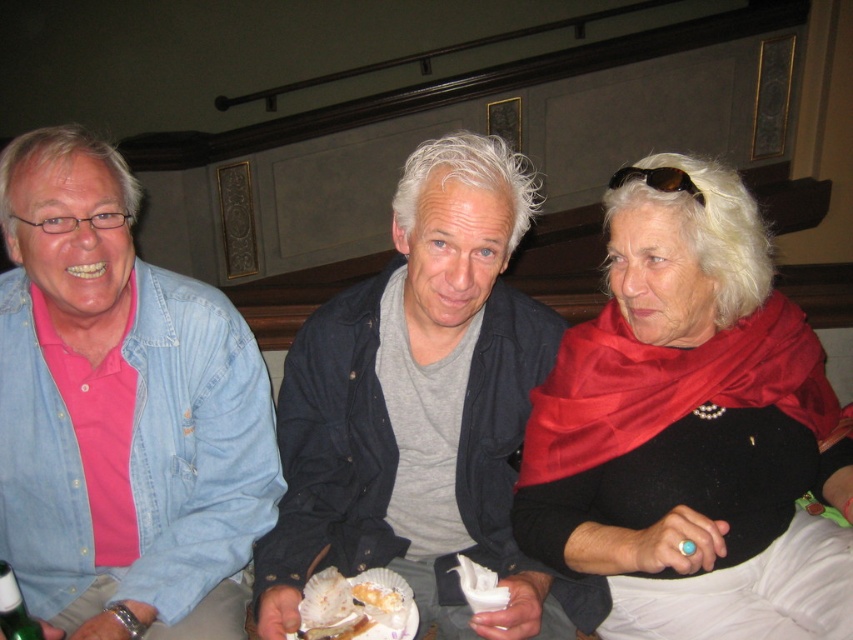
What is the color of the object located at point (692, 433) in the image?

The object at point (692, 433) is a satin red scarf.

Consider the image. You are standing in the room and want to move from the point at coordinates point (74,413) to the point at coordinates point (413,356). Which direction should you move in?

You should move backward because point (74,413) is in front of point (413,356).

You are standing in the room and want to hand a drink to the person at point (450, 484). Can you reach them without moving closer than 1.5 meters?

The distance between you and the person at point (450, 484) is 1.56 meters. Since this is slightly more than 1.5 meters, you cannot reach them without moving closer.